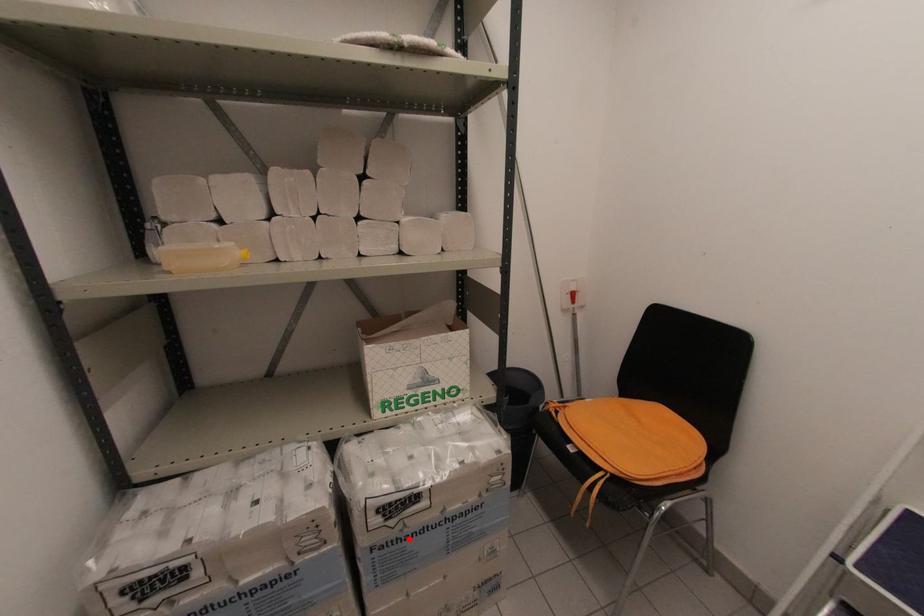
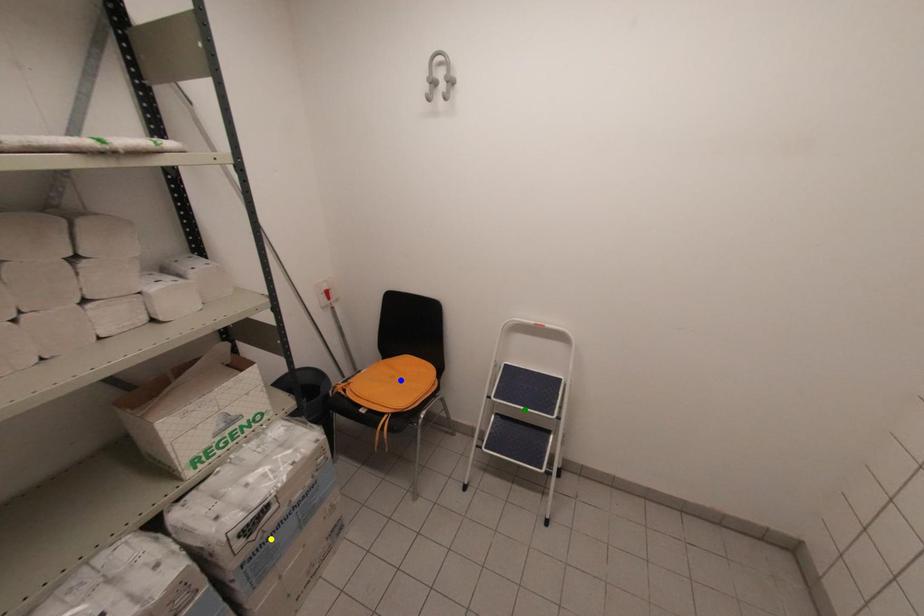
Question: I am providing you with two images of the same scene from different viewpoints. A red point is marked on the first image. You are given multiple points on the second image. Which spot in image 2 lines up with the point in image 1?

Choices:
 (A) blue point
 (B) yellow point
 (C) green point

Answer: (B)